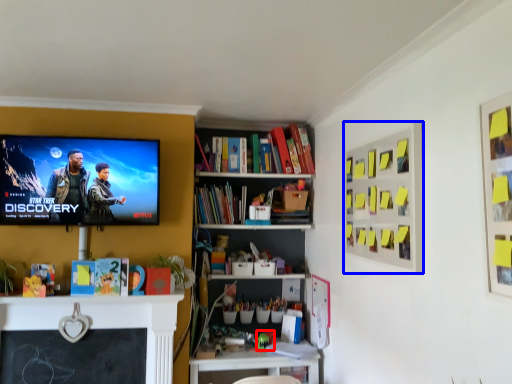
Question: Which object is further to the camera taking this photo, toy (highlighted by a red box) or bulletin board (highlighted by a blue box)?

Choices:
 (A) toy
 (B) bulletin board

Answer: (A)